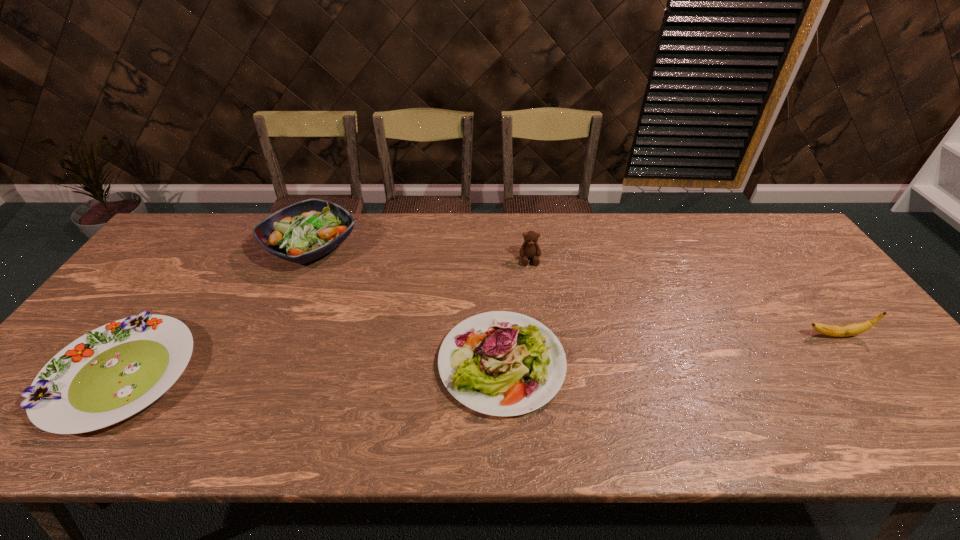
The image size is (960, 540). I want to click on free space between the second shortest object and the rightmost object, so click(x=668, y=349).

What are the coordinates of `free area in between the second shortest salad plate and the banana` in the screenshot? It's located at (668, 349).

Find the location of a particular element. The height and width of the screenshot is (540, 960). free space between the farthest salad plate and the banana is located at coordinates (573, 291).

Where is `empty space that is in between the rightmost object and the rightmost salad plate`? The image size is (960, 540). empty space that is in between the rightmost object and the rightmost salad plate is located at coordinates (668, 349).

This screenshot has height=540, width=960. In order to click on object that is the closest one to the farthest salad plate in this screenshot , I will do tap(111, 373).

Point out which object is positioned as the second nearest to the rightmost salad plate. Please provide its 2D coordinates. Your answer should be formatted as a tuple, i.e. [(x, y)], where the tuple contains the x and y coordinates of a point satisfying the conditions above.

[(304, 231)]

This screenshot has width=960, height=540. Identify the location of the closest salad plate to the fourth tallest object. (304, 231).

Locate which salad plate ranks second in proximity to the banana. Please provide its 2D coordinates. Your answer should be formatted as a tuple, i.e. [(x, y)], where the tuple contains the x and y coordinates of a point satisfying the conditions above.

[(304, 231)]